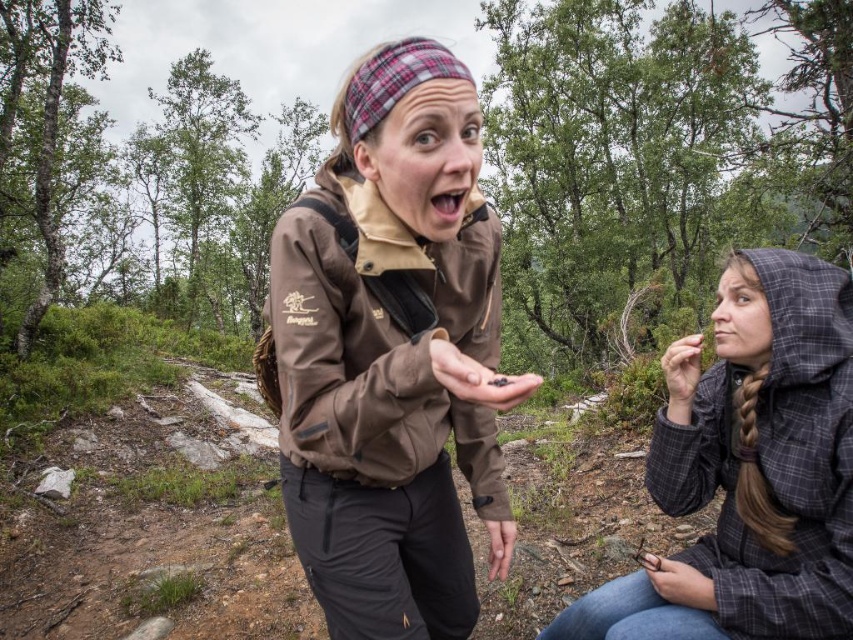
You are a hiker who has just found some berries in the forest. You want to show them to your friend who is sitting on the ground. Which object in the image is closer to your friend, the green leafy forest at center or the matte black hand at lower right?

The matte black hand at lower right is closer to your friend because the green leafy forest at center is positioned on the left side of the matte black hand at lower right, meaning the hand is nearer to the seated friend.

You are a photographer trying to capture both the plaid fabric hood at lower right and the matte black hand at lower right in the same frame. Based on their sizes, which object should you focus on first to ensure both fit in the photo?

The plaid fabric hood at lower right is bigger than the matte black hand at lower right, so you should focus on capturing the plaid fabric hood at lower right first to ensure both fit in the frame.

You are a hiker who needs to place a 10 cm wide item between the plaid fabric hood at lower right and the matte black hand at lower right. Can you fit it there?

The plaid fabric hood at lower right might be wider than matte black hand at lower right, so the 10 cm wide item may or may not fit depending on the actual width between them. Check the space first before placing the item.